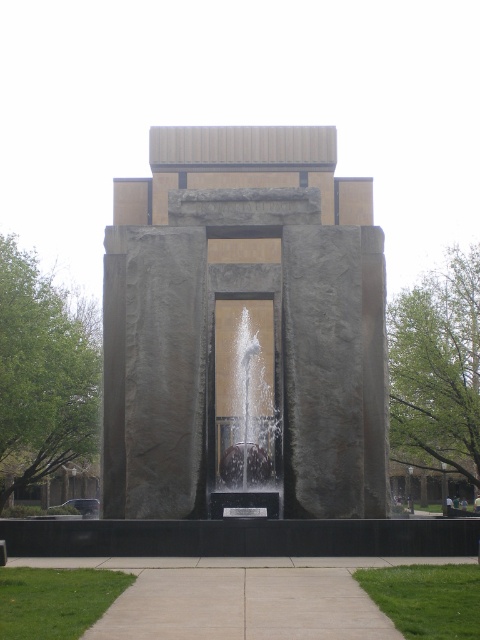
Can you confirm if gray stone fountain at center is smaller than smooth concrete pavement at center?

Actually, gray stone fountain at center might be larger than smooth concrete pavement at center.

Measure the distance from gray stone fountain at center to smooth concrete pavement at center.

gray stone fountain at center is 73.64 feet away from smooth concrete pavement at center.

Who is more forward, (305, 209) or (321, 611)?

Point (321, 611) is more forward.

You are a GUI agent. You are given a task and a screenshot of the screen. Output one action in this format:
    pyautogui.click(x=<x>, y=<y>)
    Task: Click on the gray stone fountain at center
    The image size is (480, 640).
    Given the screenshot: What is the action you would take?
    pyautogui.click(x=248, y=324)

Image resolution: width=480 pixels, height=640 pixels. Describe the element at coordinates (243, 605) in the screenshot. I see `smooth concrete pavement at center` at that location.

Is smooth concrete pavement at center behind clear glass water at center?

No, it is in front of clear glass water at center.

Where is `smooth concrete pavement at center`? This screenshot has height=640, width=480. smooth concrete pavement at center is located at coordinates [243, 605].

Which is more to the left, gray stone fountain at center or clear glass water at center?

From the viewer's perspective, clear glass water at center appears more on the left side.

Consider the image. Does gray stone fountain at center appear on the left side of clear glass water at center?

No, gray stone fountain at center is not to the left of clear glass water at center.

Which is in front, point (186, 192) or point (268, 424)?

Point (186, 192) is in front.

In order to click on gray stone fountain at center in this screenshot , I will do `click(248, 324)`.